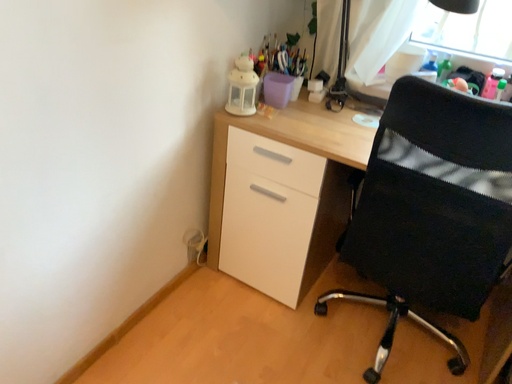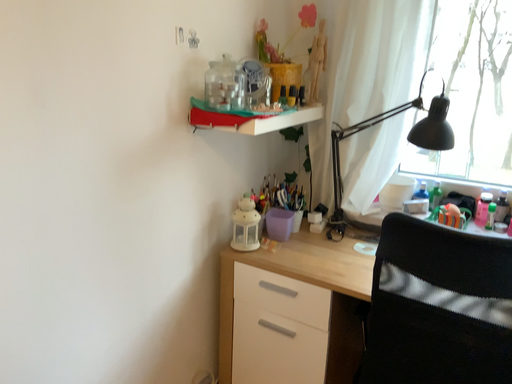
Question: Which way did the camera rotate in the video?

Choices:
 (A) rotated upward
 (B) rotated downward

Answer: (A)